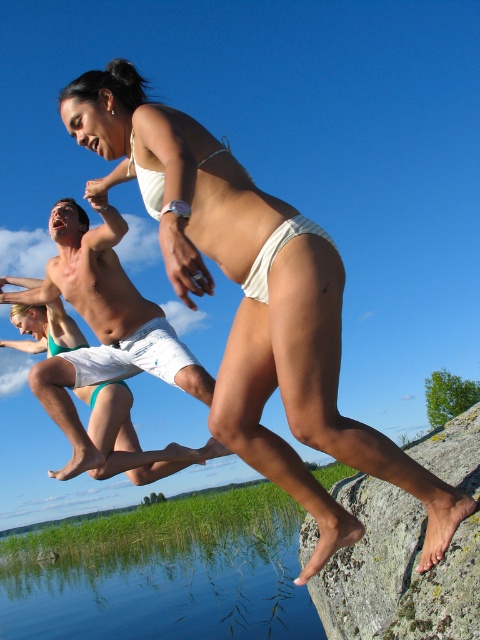
Is point (189, 586) closer to camera compared to point (259, 291)?

That is False.

Looking at this image, is transparent water at lower left shorter than white fabric bikini bottom at center?

No, transparent water at lower left is not shorter than white fabric bikini bottom at center.

At what (x,y) coordinates should I click in order to perform the action: click on transparent water at lower left. Please return your answer as a coordinate pair (x, y). This screenshot has height=640, width=480. Looking at the image, I should click on (160, 579).

Find the location of a particular element. transparent water at lower left is located at coordinates (160, 579).

Is gray rough rock at lower right to the right of white fabric bikini bottom at center from the viewer's perspective?

Correct, you'll find gray rough rock at lower right to the right of white fabric bikini bottom at center.

Which is more to the right, gray rough rock at lower right or white fabric bikini bottom at center?

gray rough rock at lower right is more to the right.

Which is in front, point (363, 582) or point (292, 218)?

Point (292, 218) is more forward.

This screenshot has width=480, height=640. Identify the location of gray rough rock at lower right. (396, 572).

Is white matte bikini bottom at center further to the viewer compared to white fabric bikini bottom at center?

No, it is not.

Does white matte bikini bottom at center have a smaller size compared to white fabric bikini bottom at center?

No.

The width and height of the screenshot is (480, 640). I want to click on white matte bikini bottom at center, so click(x=313, y=403).

This screenshot has width=480, height=640. In order to click on white matte bikini bottom at center in this screenshot , I will do `click(313, 403)`.